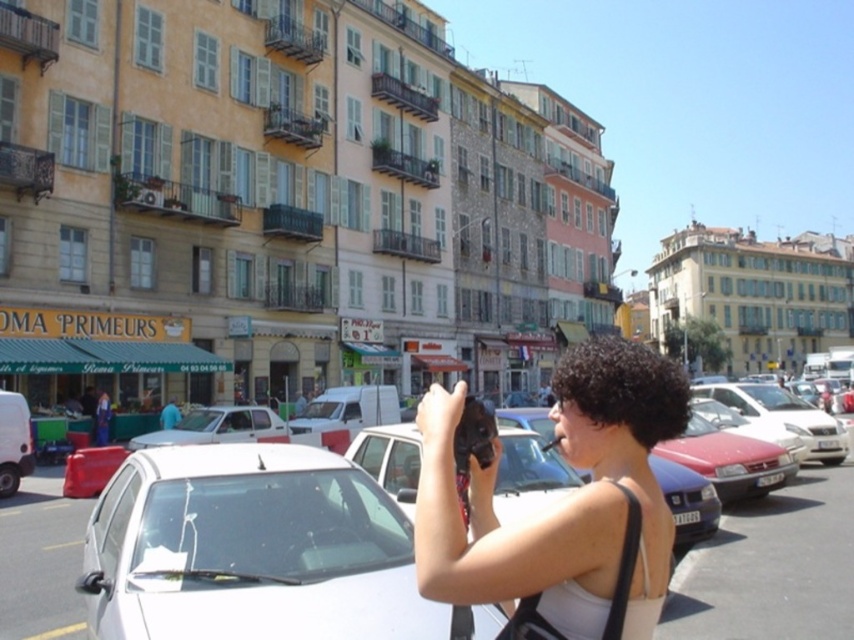
You are a delivery person who needs to park your delivery van, which is 2 meters wide, between the white glossy car at center and the matte black camera at center. Can you fit your van there?

The white glossy car at center has a lesser width compared to matte black camera at center. The distance between them is not provided, so it is impossible to determine if the van can fit. However, since the car is narrower than the camera, the space between might be sufficient, but without exact measurements, we can only assume based on the given information.

You are a photographer standing in the middle of the street. You have a matte black camera at center and a white matte car at lower left in your view. Which object is bigger in your current view?

The matte black camera at center is larger in size compared to the white matte car at lower left, so the matte black camera at center appears bigger in your view.